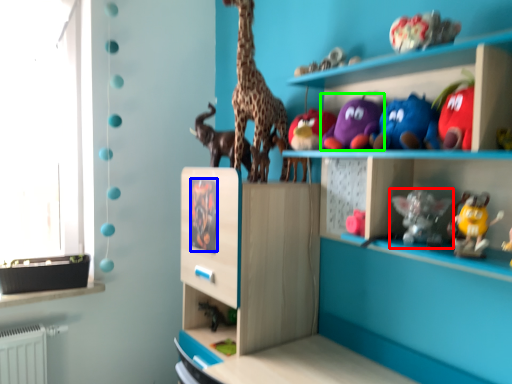
Question: Which object is positioned farthest from toy (highlighted by a red box)? Select from animal (highlighted by a blue box) and toy (highlighted by a green box).

Choices:
 (A) animal
 (B) toy

Answer: (A)